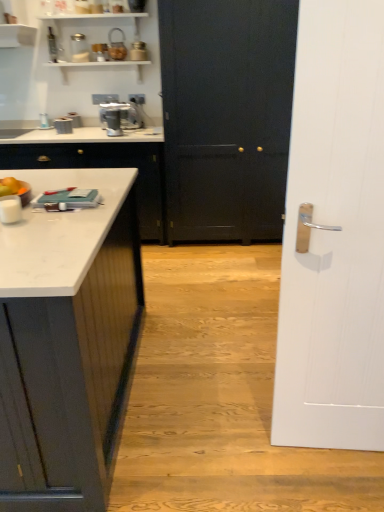
In order to face orange matte fruit at left, should I rotate leftwards or rightwards?

Rotate left and turn 23.275 degrees.

This screenshot has height=512, width=384. Describe the element at coordinates (103, 167) in the screenshot. I see `white marble countertop at left` at that location.

Measure the distance between white marble countertop at left and camera.

white marble countertop at left and camera are 3.04 meters apart.

At what (x,y) coordinates should I click in order to perform the action: click on black matte door at center, which is the 2th door from front to back. Please return your answer as a coordinate pair (x, y). This screenshot has width=384, height=512. Looking at the image, I should click on (226, 116).

Locate an element on the screen. The height and width of the screenshot is (512, 384). metallic silver coffee maker at upper center is located at coordinates (119, 117).

The height and width of the screenshot is (512, 384). What are the coordinates of `metallic textured canister at upper center` in the screenshot? It's located at (117, 46).

Considering the sizes of white wood door at right, which appears as the 1th door when viewed from the front, and metallic silver coffee maker at upper center in the image, is white wood door at right, which appears as the 1th door when viewed from the front, bigger or smaller than metallic silver coffee maker at upper center?

Considering their sizes, white wood door at right, which appears as the 1th door when viewed from the front, takes up more space than metallic silver coffee maker at upper center.

From a real-world perspective, is white wood door at right, which appears as the 1th door when viewed from the front, located beneath metallic silver coffee maker at upper center?

Yes, from a real-world perspective, white wood door at right, which appears as the 1th door when viewed from the front, is below metallic silver coffee maker at upper center.

Can you confirm if white wood door at right, acting as the 2th door starting from the back, is positioned to the left of metallic silver coffee maker at upper center?

Incorrect, white wood door at right, acting as the 2th door starting from the back, is not on the left side of metallic silver coffee maker at upper center.

Is metallic textured canister at upper center next to orange matte fruit at left?

No, metallic textured canister at upper center is not making contact with orange matte fruit at left.

From the image's perspective, is metallic textured canister at upper center located above orange matte fruit at left?

Indeed, from the image's perspective, metallic textured canister at upper center is shown above orange matte fruit at left.

Locate an element on the screen. The height and width of the screenshot is (512, 384). appliance behind the orange matte fruit at left is located at coordinates (117, 46).

From their relative heights in the image, would you say metallic textured canister at upper center is taller or shorter than orange matte fruit at left?

metallic textured canister at upper center is taller than orange matte fruit at left.

Is metallic textured canister at upper center located outside white wood door at right, acting as the 2th door starting from the back?

Yes.

Considering the relative positions of metallic textured canister at upper center and white wood door at right, acting as the 2th door starting from the back, in the image provided, is metallic textured canister at upper center behind white wood door at right, acting as the 2th door starting from the back,?

Yes, it is behind white wood door at right, acting as the 2th door starting from the back.

Is metallic textured canister at upper center next to white wood door at right, acting as the 2th door starting from the back, and touching it?

No, metallic textured canister at upper center is not with white wood door at right, acting as the 2th door starting from the back.

From a real-world perspective, relative to white wood door at right, acting as the 2th door starting from the back, is metallic textured canister at upper center vertically above or below?

From a real-world perspective, metallic textured canister at upper center is physically above white wood door at right, acting as the 2th door starting from the back.

Is white marble countertop at left turned away from metallic textured canister at upper center?

white marble countertop at left does not have its back to metallic textured canister at upper center.

Is point (119, 159) positioned before point (120, 45)?

Yes, it is.

Do you think white marble countertop at left is within metallic textured canister at upper center, or outside of it?

white marble countertop at left is located beyond the bounds of metallic textured canister at upper center.

Considering the sizes of objects white marble countertop at left and metallic textured canister at upper center in the image provided, who is taller, white marble countertop at left or metallic textured canister at upper center?

Standing taller between the two is white marble countertop at left.

Is metallic silver coffee maker at upper center looking in the opposite direction of orange matte fruit at left?

→ No, metallic silver coffee maker at upper center is not facing away from orange matte fruit at left.

Would you say metallic silver coffee maker at upper center is outside orange matte fruit at left?

That's correct, metallic silver coffee maker at upper center is outside of orange matte fruit at left.

Looking at this image, who is shorter, metallic silver coffee maker at upper center or orange matte fruit at left?

orange matte fruit at left is shorter.

Based on their sizes in the image, would you say metallic silver coffee maker at upper center is bigger or smaller than orange matte fruit at left?

metallic silver coffee maker at upper center is bigger than orange matte fruit at left.

Is white marble countertop at left surrounded by white wood door at right, acting as the 2th door starting from the back?

No, white marble countertop at left is not inside white wood door at right, acting as the 2th door starting from the back.

Is white wood door at right, acting as the 2th door starting from the back, in front of or behind white marble countertop at left in the image?

Clearly, white wood door at right, acting as the 2th door starting from the back, is in front of white marble countertop at left.

From a real-world perspective, is white wood door at right, which appears as the 1th door when viewed from the front, under white marble countertop at left?

No, from a real-world perspective, white wood door at right, which appears as the 1th door when viewed from the front, is not under white marble countertop at left.

Is the surface of white wood door at right, acting as the 2th door starting from the back, in direct contact with white marble countertop at left?

No, white wood door at right, acting as the 2th door starting from the back, is not with white marble countertop at left.

From the image's perspective, between orange matte fruit at left and white marble countertop at left, which one is located above?

From the image's view, white marble countertop at left is above.

From a real-world perspective, is orange matte fruit at left positioned above or below white marble countertop at left?

orange matte fruit at left is situated higher than white marble countertop at left in the real world.

What's the angular difference between orange matte fruit at left and white marble countertop at left's facing directions?

The facing directions of orange matte fruit at left and white marble countertop at left are 0.539 degrees apart.

You are a GUI agent. You are given a task and a screenshot of the screen. Output one action in this format:
    pyautogui.click(x=<x>, y=<y>)
    Task: Click on the cabinetry located behind the orange matte fruit at left
    
    Given the screenshot: What is the action you would take?
    pyautogui.click(x=103, y=167)

Where is `the 2nd door in front when counting from the metallic silver coffee maker at upper center`? the 2nd door in front when counting from the metallic silver coffee maker at upper center is located at coordinates (334, 234).

In the image, there is a metallic textured canister at upper center. Where is `food below it (from the image's perspective)`? food below it (from the image's perspective) is located at coordinates (12, 187).

When comparing their distances from white marble countertop at left, does metallic silver coffee maker at upper center or black matte door at center, which ranks as the first door in back-to-front order, seem closer?

The object closer to white marble countertop at left is metallic silver coffee maker at upper center.

Estimate the real-world distances between objects in this image. Which object is closer to metallic textured canister at upper center, metallic silver coffee maker at upper center or white marble countertop at left?

Based on the image, metallic silver coffee maker at upper center appears to be nearer to metallic textured canister at upper center.

Based on their spatial positions, is metallic silver coffee maker at upper center or white marble countertop at left closer to orange matte fruit at left?

Among the two, white marble countertop at left is located nearer to orange matte fruit at left.

Looking at the image, which one is located closer to white marble countertop at left, metallic textured canister at upper center or black matte door at center, which is the 2th door from front to back?

Based on the image, black matte door at center, which is the 2th door from front to back, appears to be nearer to white marble countertop at left.

Considering their positions, is white marble countertop at left positioned closer to black matte door at center, which is the 2th door from front to back, than white wood door at right, acting as the 2th door starting from the back?

Among the two, white marble countertop at left is located nearer to black matte door at center, which is the 2th door from front to back.

Estimate the real-world distances between objects in this image. Which object is closer to white marble countertop at left, metallic textured canister at upper center or metallic silver coffee maker at upper center?

metallic silver coffee maker at upper center is positioned closer to the anchor white marble countertop at left.

From the image, which object appears to be nearer to metallic silver coffee maker at upper center, black matte door at center, which is the 2th door from front to back, or white wood door at right, acting as the 2th door starting from the back?

black matte door at center, which is the 2th door from front to back.

When comparing their distances from white marble countertop at left, does black matte door at center, which is the 2th door from front to back, or metallic textured canister at upper center seem further?

The object further to white marble countertop at left is metallic textured canister at upper center.

Find the location of `food between white wood door at right, which appears as the 1th door when viewed from the front, and metallic textured canister at upper center from front to back`. food between white wood door at right, which appears as the 1th door when viewed from the front, and metallic textured canister at upper center from front to back is located at coordinates (12, 187).

The width and height of the screenshot is (384, 512). I want to click on appliance located between orange matte fruit at left and metallic silver coffee maker at upper center in the depth direction, so click(x=117, y=46).

Locate an element on the screen. home appliance between white marble countertop at left and black matte door at center, which is the 2th door from front to back is located at coordinates (119, 117).

The width and height of the screenshot is (384, 512). Identify the location of food located between white wood door at right, which appears as the 1th door when viewed from the front, and white marble countertop at left in the depth direction. point(12,187).